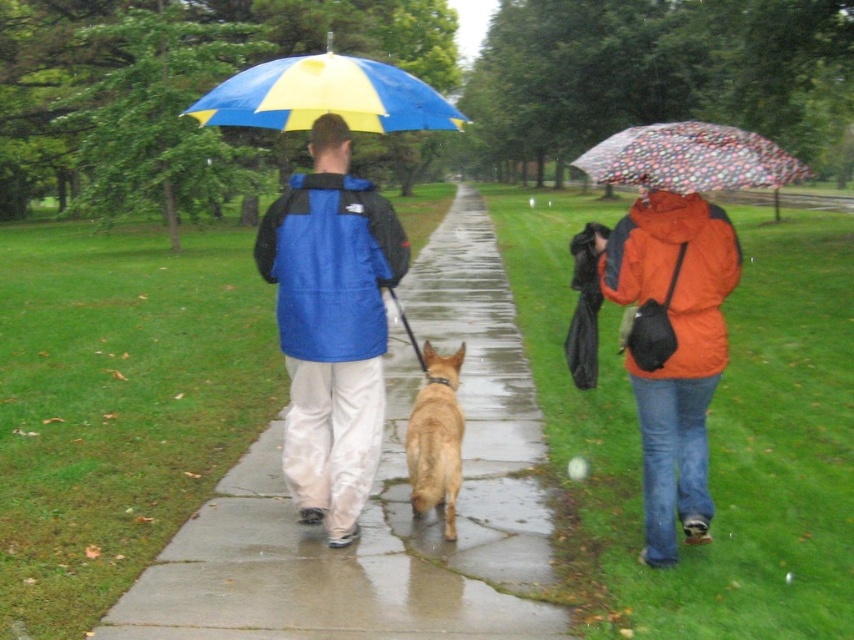
You are standing at the camera position looking at the scene. There are two points marked in the image, point A at point (319, 54) and point B at point (632, 161). Which point is closer to you?

Point A at point (319, 54) is closer to you because it is further to the camera than point B at point (632, 161).

You are a delivery robot with a 1 meter wide package. You need to move along the concrete sidewalk at center. Considering the transparent polka dot umbrella at center is in the way, will the space between them allow your package to fit through?

The concrete sidewalk at center has a smaller size compared to transparent polka dot umbrella at center. Therefore, the space between them may not be sufficient for a 1 meter wide package to pass through safely.

You are standing at the point marked as point [382,500] in the image. What is the surface you are standing on?

The surface at point 0.783, 0448 is concrete sidewalk at center.